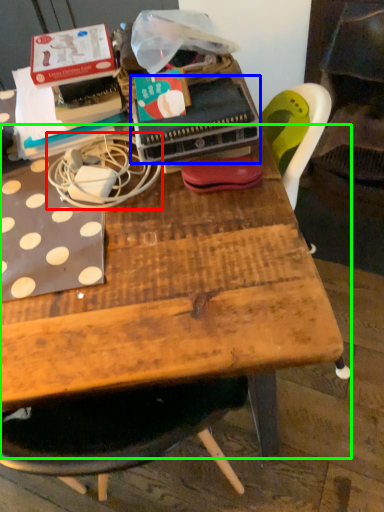
Question: Considering the real-world distances, which object is closest to string (highlighted by a red box)? paperback book (highlighted by a blue box) or table (highlighted by a green box).

Choices:
 (A) paperback book
 (B) table

Answer: (A)